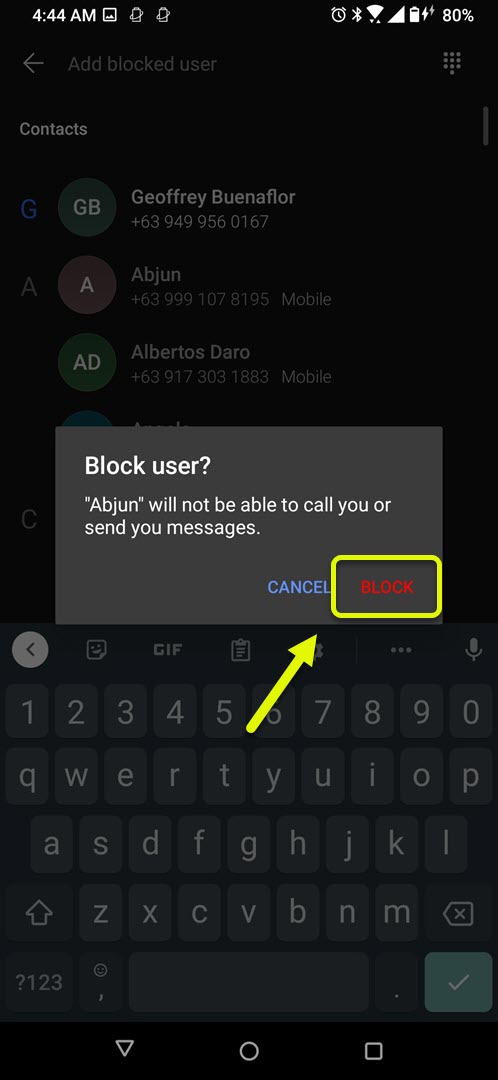
The width and height of the screenshot is (498, 1080). Find the location of `qwerty keyboard`. qwerty keyboard is located at coordinates 218,822.